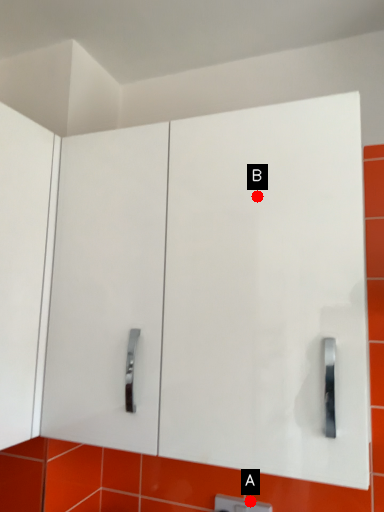
Question: Two points are circled on the image, labeled by A and B beside each circle. Which point is closer to the camera?

Choices:
 (A) A is closer
 (B) B is closer

Answer: (B)